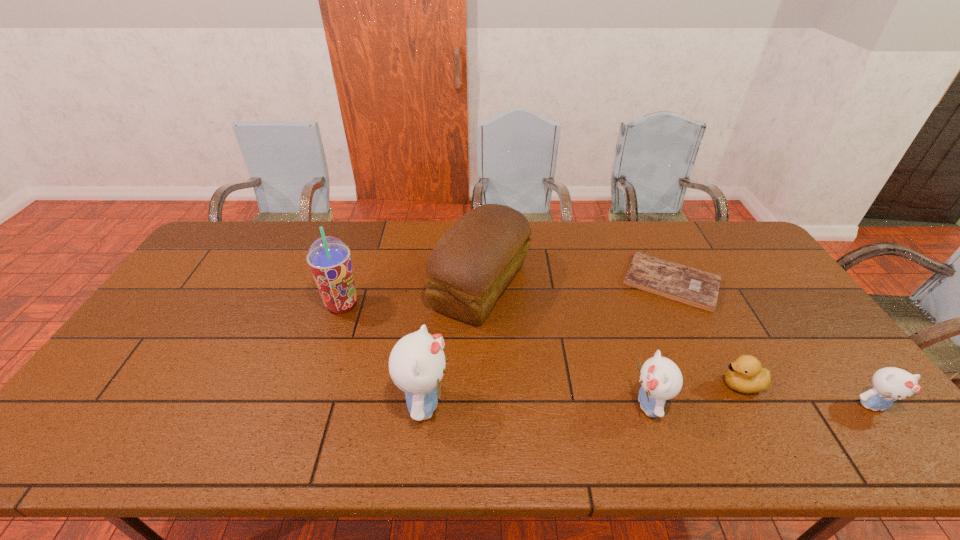
Where is `object that is the third closest to the tallest kitten`? The width and height of the screenshot is (960, 540). object that is the third closest to the tallest kitten is located at coordinates (661, 379).

Find the location of `kitten object that ranks as the second closest to the leftmost kitten`. kitten object that ranks as the second closest to the leftmost kitten is located at coordinates (889, 384).

Image resolution: width=960 pixels, height=540 pixels. I want to click on kitten that can be found as the second closest to the second shortest kitten, so click(x=889, y=384).